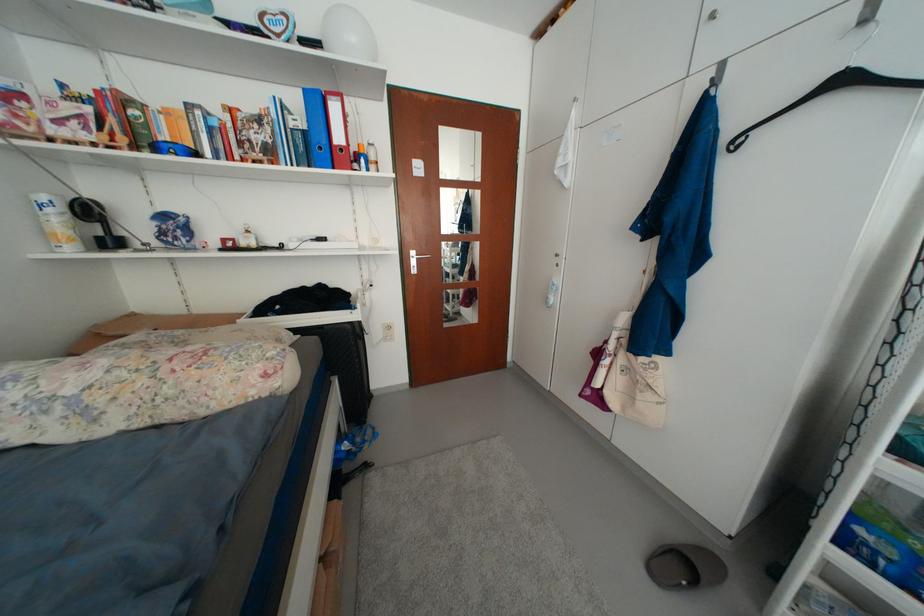
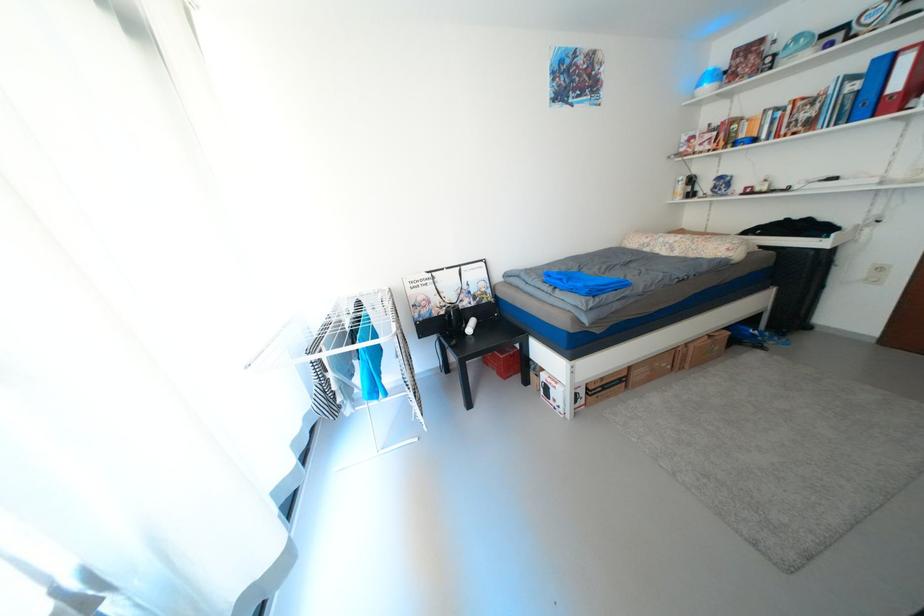
Where in the second image is the point corresponding to pixel 344 110 from the first image?

(916, 62)